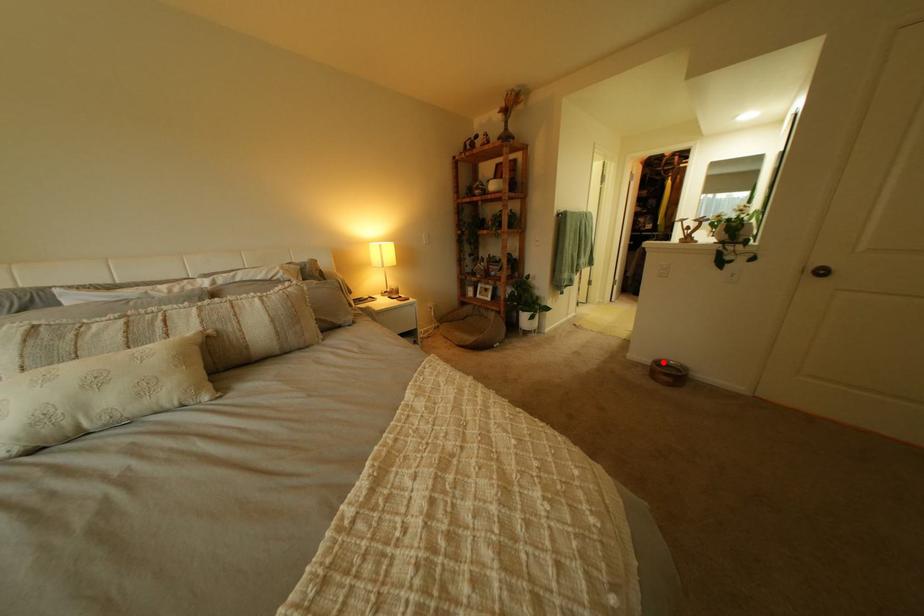
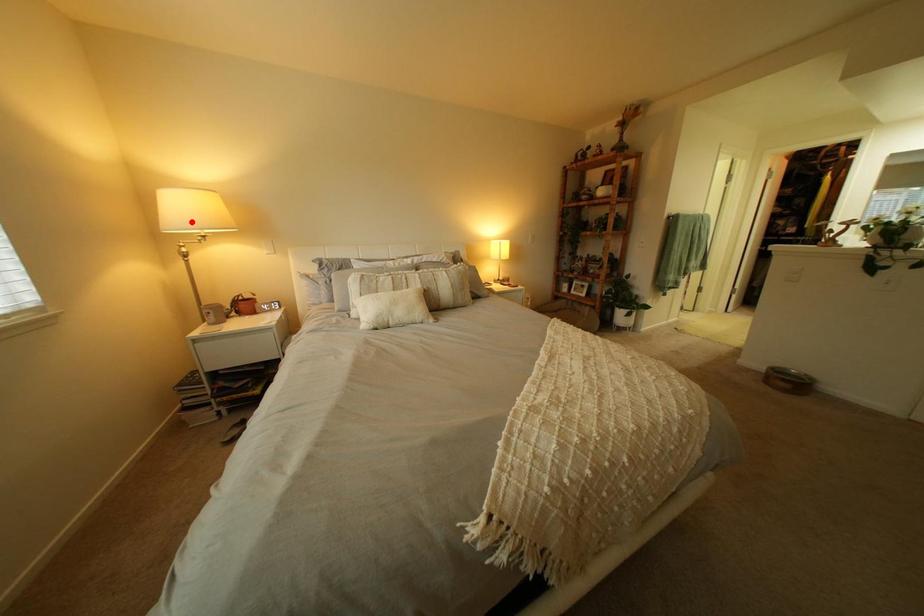
I am providing you with two images of the same scene from different viewpoints. A red point is marked on the first image and another point is marked on the second image. Are the points marked in image1 and image2 representing the same 3D position?

No